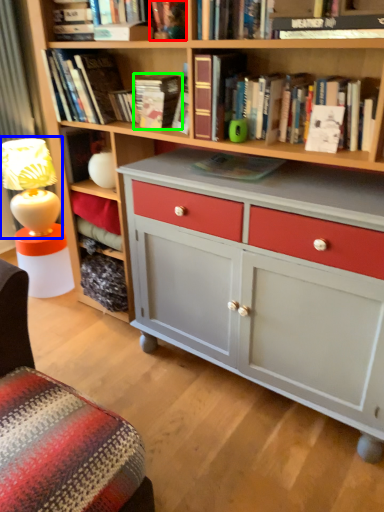
Question: Which object is positioned farthest from book (highlighted by a red box)? Select from table lamp (highlighted by a blue box) and book (highlighted by a green box).

Choices:
 (A) table lamp
 (B) book

Answer: (A)